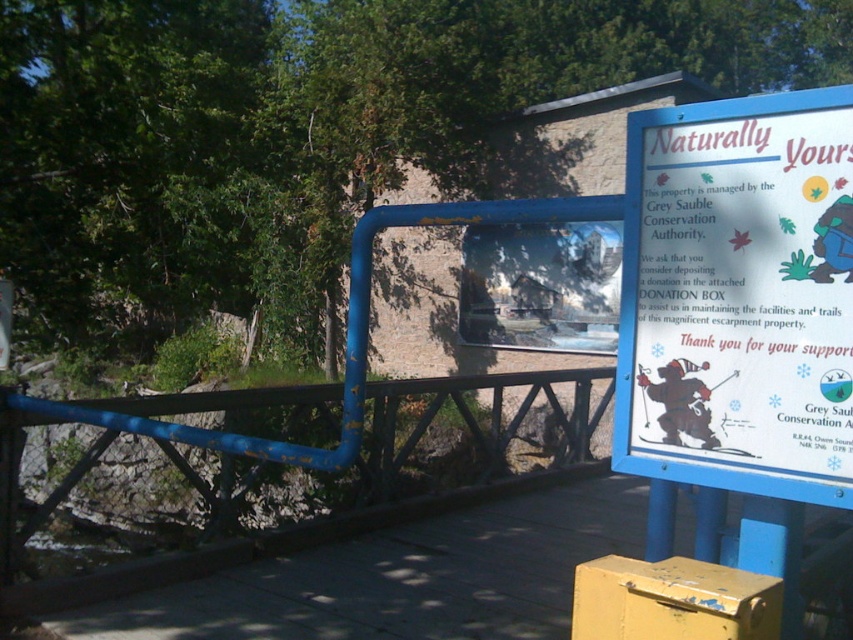
You are standing at the base of the trail looking up at the signboard. There is a point marked at coordinates (740,294). What object is located at that point?

The white paper sign at upper right is located at point (740,294).

You are a hiker who wants to take a photo of the blue painted metal rail at center and the white paper sign at upper right. Which object should you focus on first if you want to include both in a single frame without moving your camera? Explain your reasoning based on their sizes.

The white paper sign at upper right is much taller than the blue painted metal rail at center. To include both in a single frame without moving the camera, focus on the taller white paper sign at upper right first, as it requires more space vertically. Adjust the camera angle to ensure the shorter blue painted metal rail at center also fits into the frame.